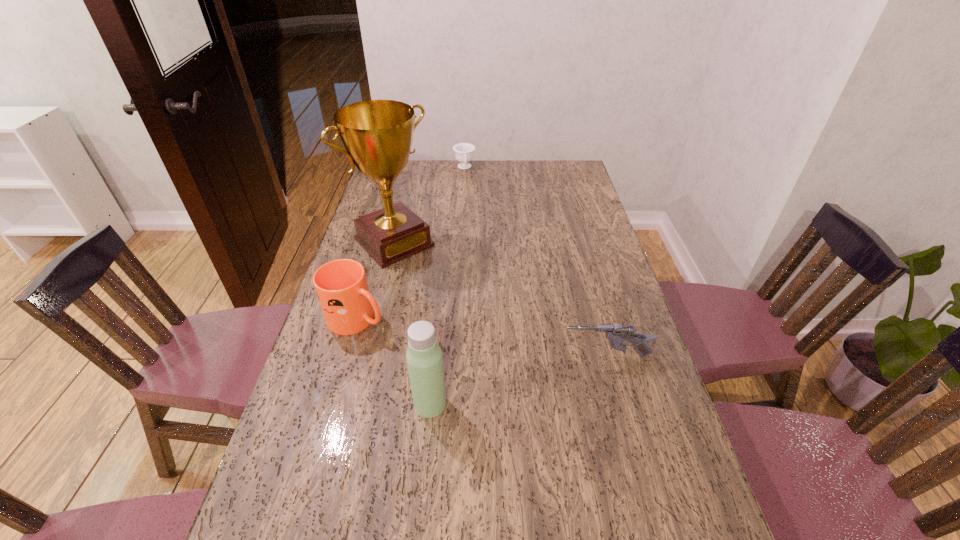
The image size is (960, 540). Find the location of `vacant region located on the front of the fourth shortest object`. vacant region located on the front of the fourth shortest object is located at coordinates (425, 455).

What are the coordinates of `free space located 0.180m at the barrel of the rightmost object` in the screenshot? It's located at click(494, 356).

Where is `free space located at the barrel of the rightmost object`? free space located at the barrel of the rightmost object is located at coordinates (435, 356).

Find the location of a particular element. This screenshot has height=540, width=960. free space located 0.220m at the barrel of the rightmost object is located at coordinates (479, 356).

Locate an element on the screen. free space located on the handle side of the third farthest object is located at coordinates (436, 352).

This screenshot has height=540, width=960. What are the coordinates of `vacant space positioned on the handle side of the third farthest object` in the screenshot? It's located at (396, 334).

You are a GUI agent. You are given a task and a screenshot of the screen. Output one action in this format:
    pyautogui.click(x=<x>, y=<y>)
    Task: Click on the vacant region located 0.170m on the handle side of the third farthest object
    
    Given the screenshot: What is the action you would take?
    click(x=432, y=350)

Identify the location of vacant position located on the plaque of the tallest object. (458, 305).

Find the location of a particular element. This screenshot has width=960, height=540. vacant space located on the plaque of the tallest object is located at coordinates (474, 321).

Locate an element on the screen. vacant space situated 0.320m on the plaque of the tallest object is located at coordinates (471, 319).